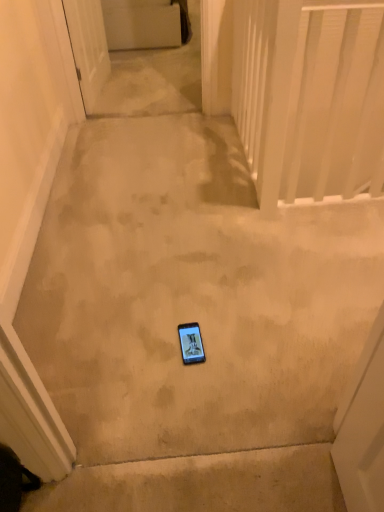
Where is `unoccupied area in front of white plastic balustrade at upper right`? The height and width of the screenshot is (512, 384). unoccupied area in front of white plastic balustrade at upper right is located at coordinates (304, 239).